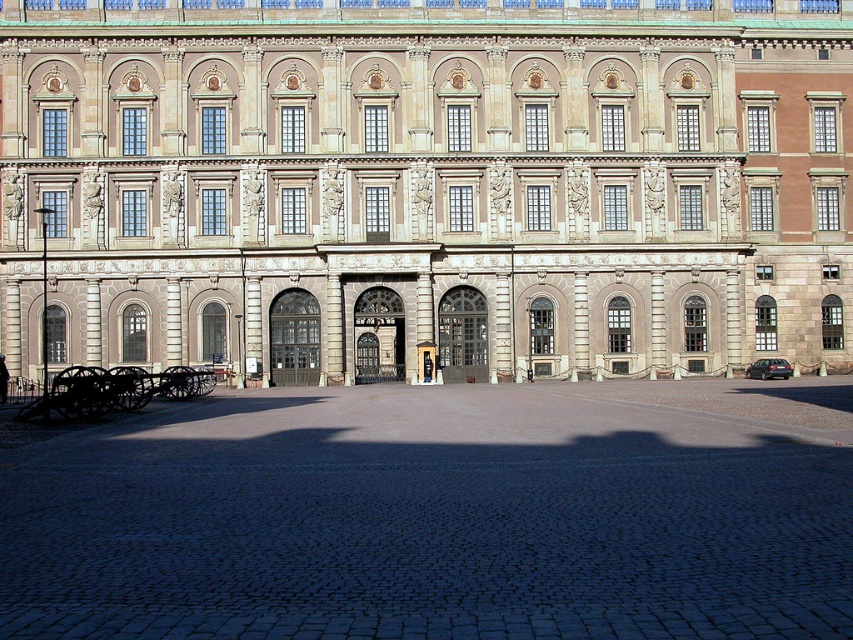
Question: Observing the image, what is the correct spatial positioning of beige stone palace at center in reference to dark cobblestone courtyard at center?

Choices:
 (A) below
 (B) above

Answer: (B)

Question: Which object is positioned farthest from the black polished cannon at lower left?

Choices:
 (A) beige stone palace at center
 (B) dark cobblestone courtyard at center

Answer: (A)

Question: Which point is closer to the camera?

Choices:
 (A) beige stone palace at center
 (B) black polished cannon at lower left

Answer: (B)

Question: Which object is positioned closest to the dark cobblestone courtyard at center?

Choices:
 (A) beige stone palace at center
 (B) black polished cannon at lower left

Answer: (B)

Question: Can you confirm if beige stone palace at center is positioned to the left of dark cobblestone courtyard at center?

Choices:
 (A) yes
 (B) no

Answer: (B)

Question: Is beige stone palace at center bigger than dark cobblestone courtyard at center?

Choices:
 (A) yes
 (B) no

Answer: (A)